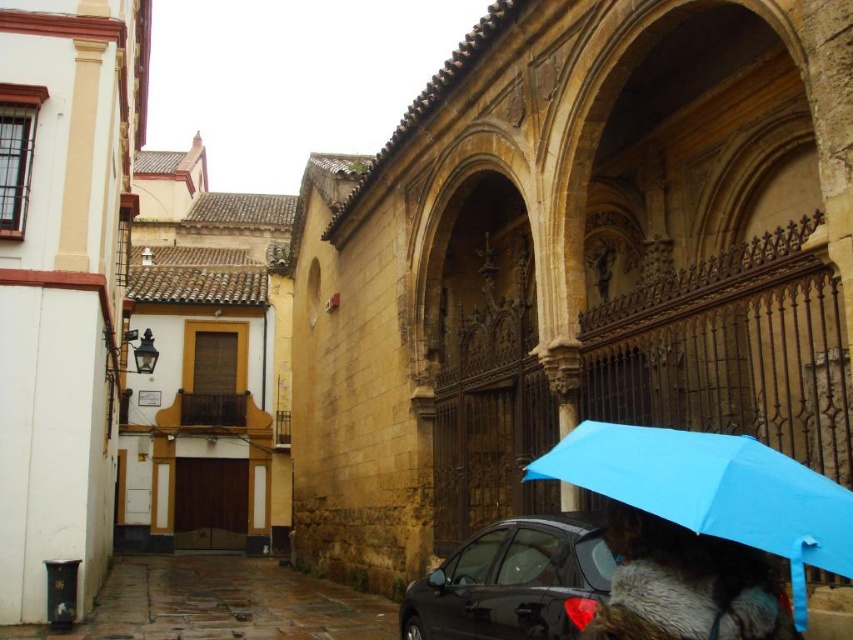
Is blue matte umbrella at lower right below glossy black car at lower center?

Actually, blue matte umbrella at lower right is above glossy black car at lower center.

Find the location of a particular element. Image resolution: width=853 pixels, height=640 pixels. blue matte umbrella at lower right is located at coordinates (712, 490).

You are a GUI agent. You are given a task and a screenshot of the screen. Output one action in this format:
    pyautogui.click(x=<x>, y=<y>)
    Task: Click on the blue matte umbrella at lower right
    The width and height of the screenshot is (853, 640).
    Given the screenshot: What is the action you would take?
    pyautogui.click(x=712, y=490)

Is blue matte umbrella at lower right shorter than fur coat at lower right?

In fact, blue matte umbrella at lower right may be taller than fur coat at lower right.

Can you confirm if blue matte umbrella at lower right is bigger than fur coat at lower right?

Indeed, blue matte umbrella at lower right has a larger size compared to fur coat at lower right.

What do you see at coordinates (712, 490) in the screenshot?
I see `blue matte umbrella at lower right` at bounding box center [712, 490].

Locate an element on the screen. This screenshot has width=853, height=640. blue matte umbrella at lower right is located at coordinates (712, 490).

Is glossy black car at lower center to the left of fur coat at lower right from the viewer's perspective?

Yes, glossy black car at lower center is to the left of fur coat at lower right.

The width and height of the screenshot is (853, 640). What do you see at coordinates (514, 582) in the screenshot?
I see `glossy black car at lower center` at bounding box center [514, 582].

Where is `glossy black car at lower center`? This screenshot has width=853, height=640. glossy black car at lower center is located at coordinates (514, 582).